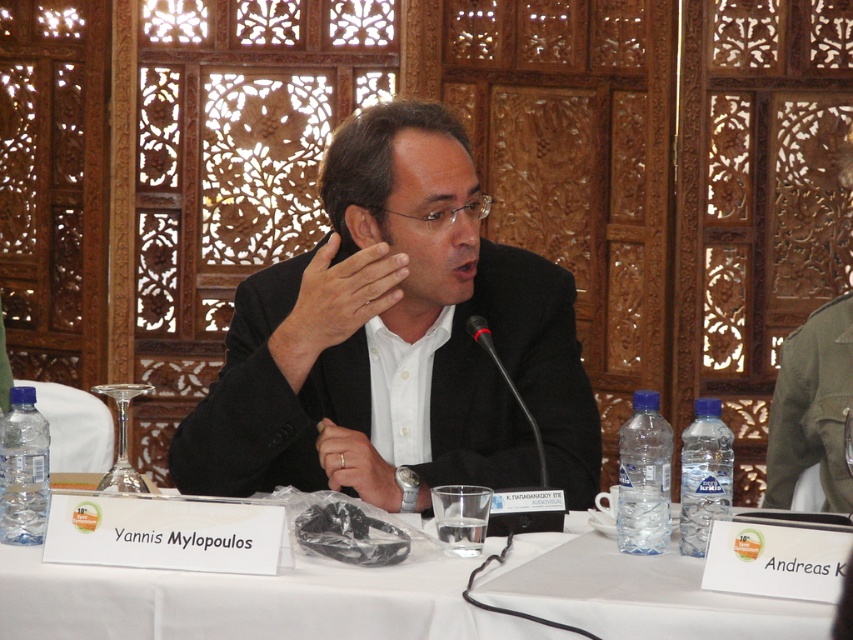
You are a photographer at the event and need to position a spotlight directly above the black matte suit at center. What are the coordinates where you should place the spotlight?

The coordinates for placing the spotlight directly above the black matte suit at center are at point (396, 330).

You are a fashion designer observing a man wearing a black matte suit at center and noticing his smooth skin hand at center. Which item is smaller in size?

The black matte suit at center is smaller in size compared to the smooth skin hand at center.